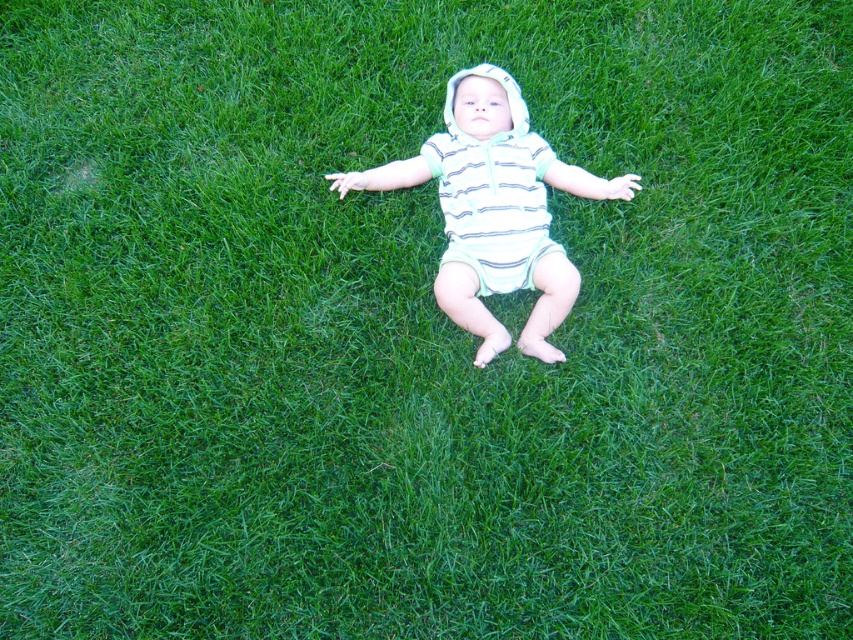
You are a photographer setting up for a baby photoshoot. The baby is wearing a striped cotton onesie at center and a striped cotton diaper at center. You need to ensure the onesie and diaper are visible in the frame. Since the onesie is wider than the diaper, which item should you focus on to ensure both are fully visible?

The striped cotton onesie at center is wider than the striped cotton diaper at center, so focusing on the onesie ensures both items are fully visible in the frame.

You are a photographer taking a picture of the baby in the image. You need to place a small toy to the left of the striped cotton onesie at center and to the right of the striped cotton diaper at center. Is this possible based on their current positions?

The striped cotton onesie at center is to the right of the striped cotton diaper at center, so placing a toy to the left of the onesie and to the right of the diaper is possible since there is space between them.

In the scene shown: You are a photographer setting up a shot of the baby lying on the lawn. You need to ensure that the striped cotton onesie at center and the striped cotton diaper at center are both visible in the frame. Based on their sizes, which item will appear larger in the photo?

The striped cotton onesie at center will appear larger in the photo because it has a greater height compared to the striped cotton diaper at center.